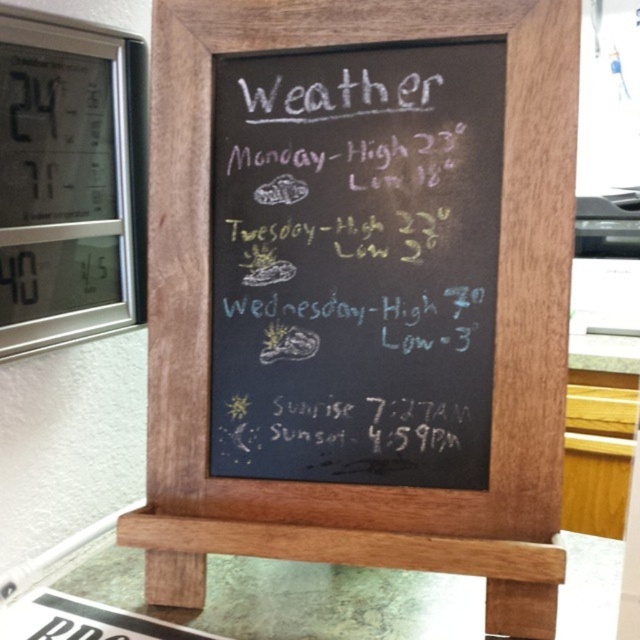
You are standing in a room with a wooden framed chalkboard on a glass surface. There is a point at coordinates (x=355, y=262). What object is located at this point?

The point at coordinates (x=355, y=262) indicates the white paperboard menu at center.

You are a visitor in the building and want to check the weather forecast for Wednesday. The white chalkboard at center has the weather info, but the silver digital clock at upper left might block your view. Can you see the Wednesday weather details clearly?

The white chalkboard at center is taller than the silver digital clock at upper left, so the chalkboard likely extends below the clock. Since the Wednesday weather details are probably at the bottom of the chalkboard, you should be able to see them clearly as they are not blocked by the smaller clock.